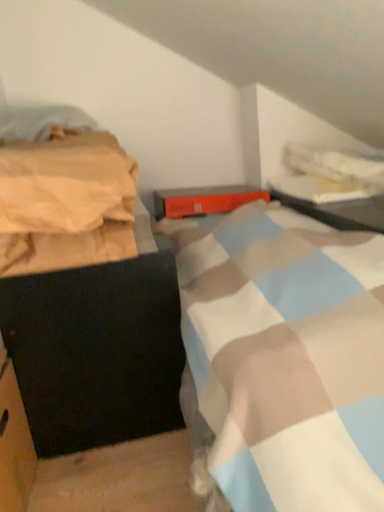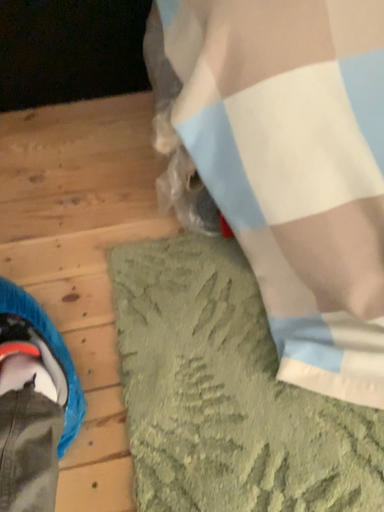
Question: Which way did the camera rotate in the video?

Choices:
 (A) rotated downward
 (B) rotated upward

Answer: (A)